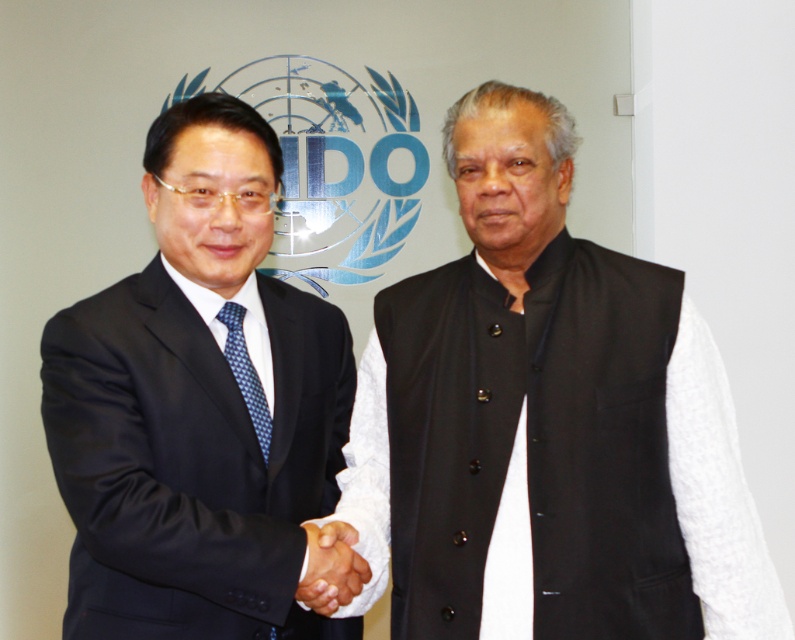
You are organizing a formal event and need to ensure that the two men can sit side by side on a bench that is 1.5 meters wide. Given the black cotton vest at center and the matte black suit at left, which of their clothing items takes up more horizontal space?

The black cotton vest at center takes up more horizontal space than the matte black suit at left because its width is larger.

You are a photographer at the event and need to capture a closeup shot of the black cotton vest at center and the black matte hand at center. From the perspective of the camera, which object is positioned to the right of the other?

The black cotton vest at center is to the right of the black matte hand at center.